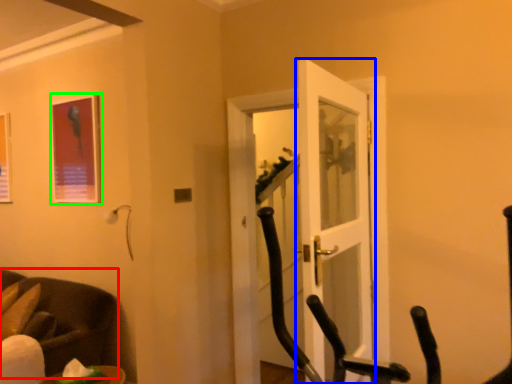
Question: Based on their relative distances, which object is nearer to chair (highlighted by a red box)? Choose from door (highlighted by a blue box) and picture frame (highlighted by a green box).

Choices:
 (A) door
 (B) picture frame

Answer: (B)